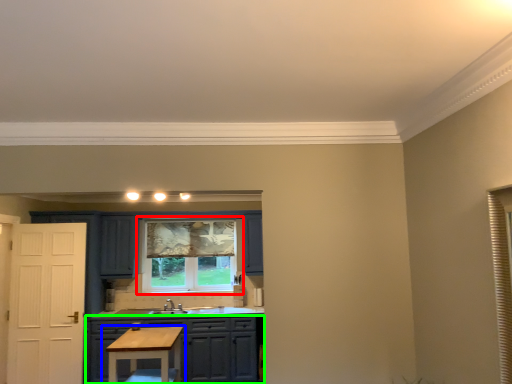
Question: Which object is positioned closest to window (highlighted by a red box)? Select from table (highlighted by a blue box) and cabinetry (highlighted by a green box).

Choices:
 (A) table
 (B) cabinetry

Answer: (B)